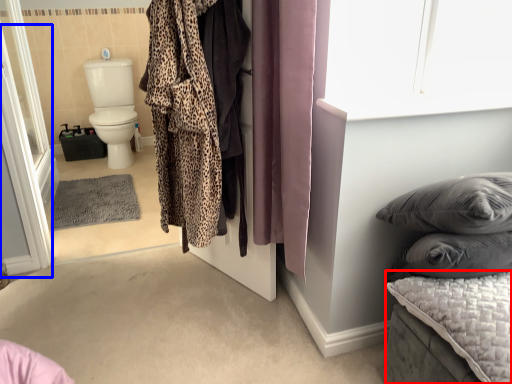
Question: Which of the following is the farthest to the observer, mattress (highlighted by a red box) or screen door (highlighted by a blue box)?

Choices:
 (A) mattress
 (B) screen door

Answer: (B)